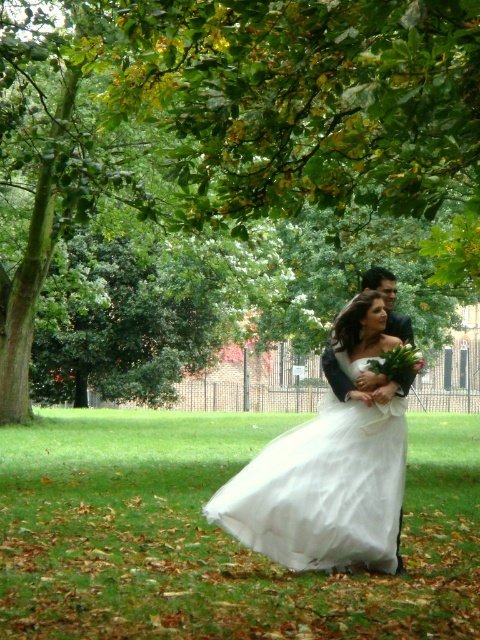
You are a photographer planning to capture the couple in the scene. You need to ensure the white tulle dress at center is fully visible without being obscured by the green leafy tree at upper center. Based on their sizes, is this possible?

The green leafy tree at upper center might be wider than the white tulle dress at center, so there is a possibility that the tree could partially obscure the dress if not positioned carefully.